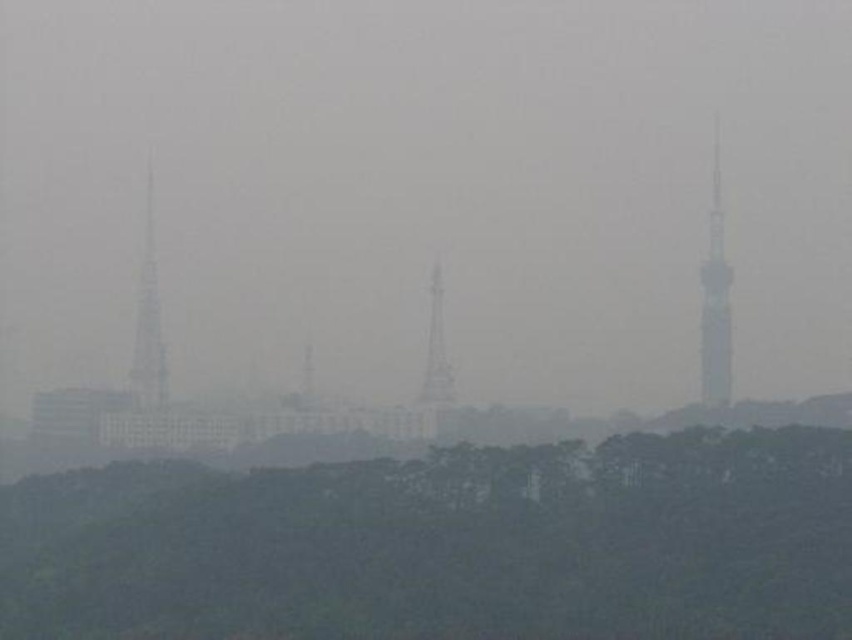
Is dark green foliage at lower center in front of metallic silver tower at right?

That is True.

Does dark green foliage at lower center have a greater width compared to metallic silver tower at right?

Correct, the width of dark green foliage at lower center exceeds that of metallic silver tower at right.

Is point (657, 512) farther from camera compared to point (717, 298)?

No, it is not.

Identify the location of dark green foliage at lower center. The width and height of the screenshot is (852, 640). (446, 545).

Describe the element at coordinates (446, 545) in the screenshot. I see `dark green foliage at lower center` at that location.

Is dark green foliage at lower center wider than smokey gray tower at center?

Yes.

Who is more distant from viewer, (568, 532) or (438, 323)?

Point (568, 532)

The height and width of the screenshot is (640, 852). I want to click on dark green foliage at lower center, so click(x=446, y=545).

Does point (718, 160) come farther from viewer compared to point (148, 186)?

Yes.

This screenshot has height=640, width=852. I want to click on metallic silver tower at right, so click(x=715, y=300).

The image size is (852, 640). What are the coordinates of `metallic silver tower at right` in the screenshot? It's located at (715, 300).

At what (x,y) coordinates should I click in order to perform the action: click on metallic silver tower at right. Please return your answer as a coordinate pair (x, y). Looking at the image, I should click on (715, 300).